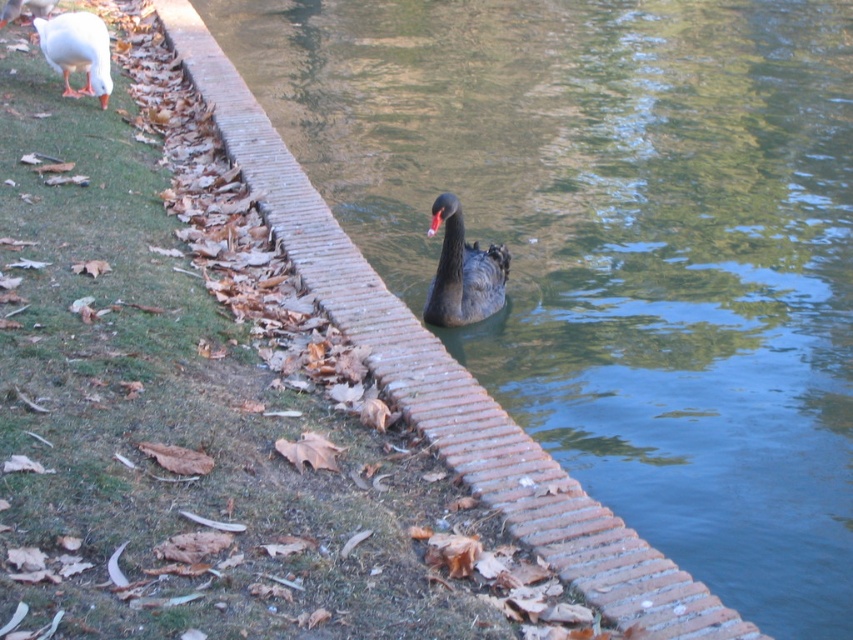
Question: Is brick at center to the left of white matte duck at upper left from the viewer's perspective?

Choices:
 (A) yes
 (B) no

Answer: (B)

Question: Is brick at center further to camera compared to white matte duck at upper left?

Choices:
 (A) no
 (B) yes

Answer: (A)

Question: Which point appears farthest from the camera in this image?

Choices:
 (A) coord(457,282)
 (B) coord(61,17)

Answer: (B)

Question: Among these points, which one is nearest to the camera?

Choices:
 (A) (196, 17)
 (B) (450, 298)

Answer: (B)

Question: From the image, what is the correct spatial relationship of brick at center in relation to white matte duck at upper left?

Choices:
 (A) above
 (B) below

Answer: (B)

Question: Which of these objects is positioned farthest from the white matte duck at upper left?

Choices:
 (A) shiny black swan at center
 (B) brick at center

Answer: (A)